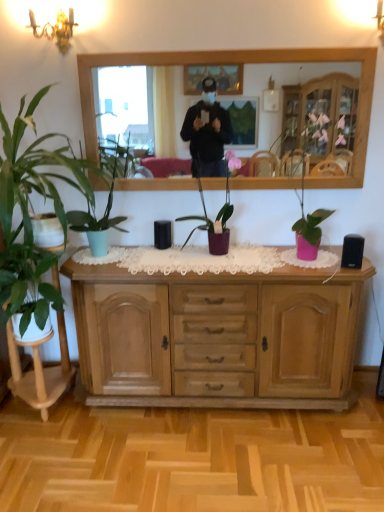
Question: In terms of size, does light brown wood cabinet at center appear bigger or smaller than green matte plant at left, acting as the 3th houseplant starting from the left?

Choices:
 (A) small
 (B) big

Answer: (B)

Question: Considering the positions of light brown wood cabinet at center and green matte plant at left, acting as the 3th houseplant starting from the left, in the image, is light brown wood cabinet at center wider or thinner than green matte plant at left, acting as the 3th houseplant starting from the left,?

Choices:
 (A) thin
 (B) wide

Answer: (B)

Question: Which object is the closest to the purple matte plant at center, placed as the fourth houseplant when sorted from left to right?

Choices:
 (A) green matte plant at left, acting as the 3th houseplant starting from the left
 (B) green matte plant at left, marked as the third houseplant in a right-to-left arrangement
 (C) wooden mirror at upper center
 (D) green glossy plant at left, which is the 4th houseplant from right to left
 (E) light brown wood cabinet at center

Answer: (A)

Question: Estimate the real-world distances between objects in this image. Which object is farther from the purple matte plant at center, placed as the 1th houseplant when sorted from right to left?

Choices:
 (A) light brown wood cabinet at center
 (B) green matte plant at left, the 2th houseplant positioned from the left
 (C) wooden mirror at upper center
 (D) green glossy plant at left, which is counted as the first houseplant, starting from the left
 (E) green matte plant at left, marked as the 2th houseplant in a right-to-left arrangement

Answer: (C)